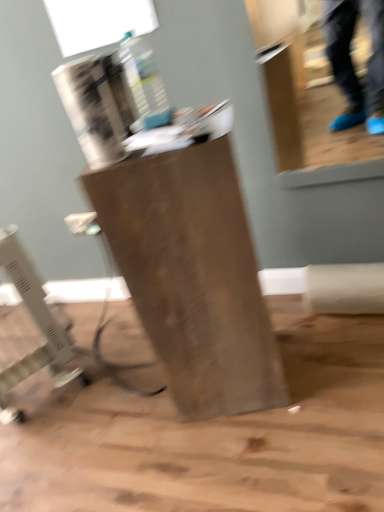
Image resolution: width=384 pixels, height=512 pixels. Identify the location of blank space above matte brown cabinet at center (from a real-world perspective). (162, 131).